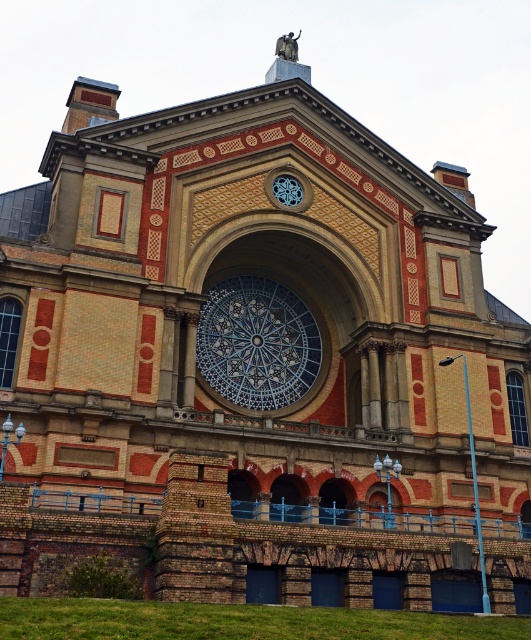
From the picture: Can you confirm if blue stained glass window at center is positioned to the left of matte metal clock at upper center?

Yes, blue stained glass window at center is to the left of matte metal clock at upper center.

Who is higher up, blue stained glass window at center or matte metal clock at upper center?

matte metal clock at upper center

This screenshot has width=531, height=640. I want to click on blue stained glass window at center, so click(256, 342).